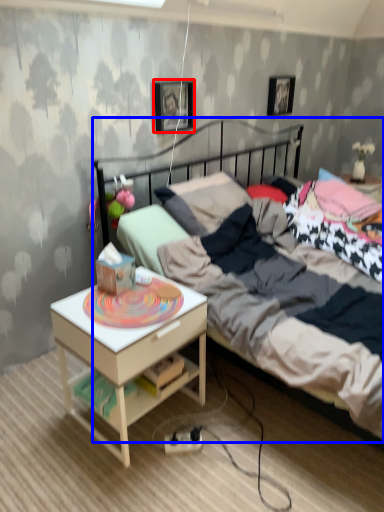
Question: Which object appears farthest to the camera in this image, picture frame (highlighted by a red box) or bed (highlighted by a blue box)?

Choices:
 (A) picture frame
 (B) bed

Answer: (A)